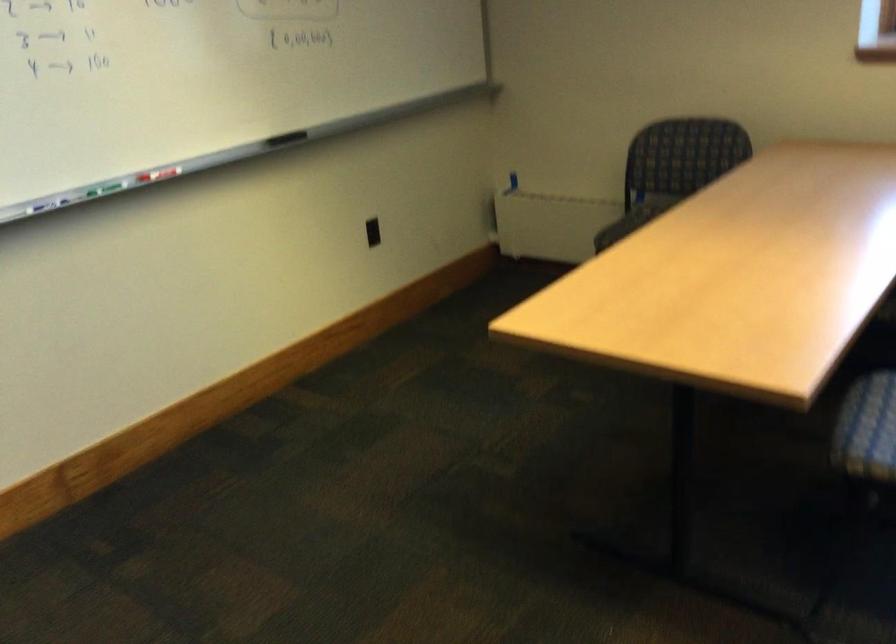
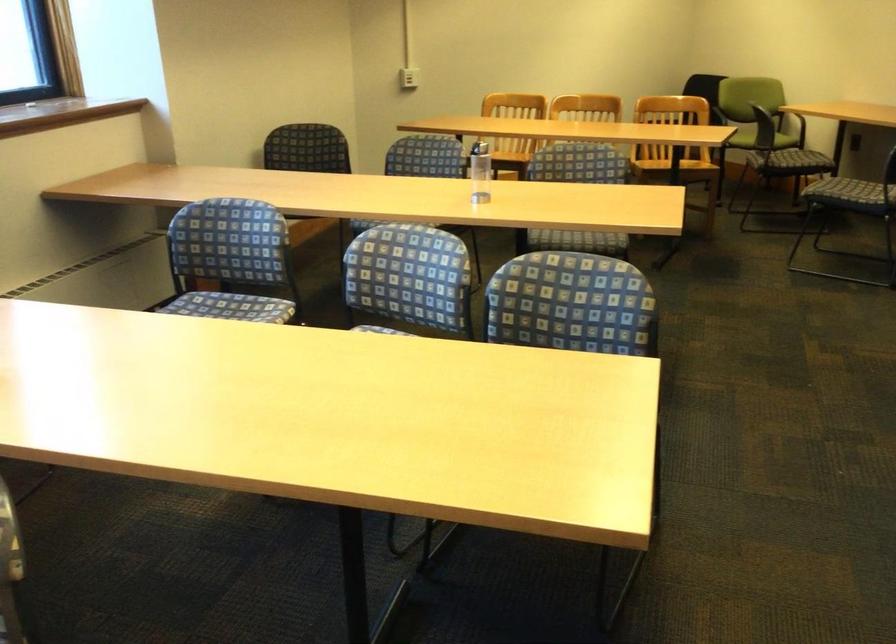
The images are taken continuously from a first-person perspective. In which direction is your viewpoint rotating?

The camera rotated toward right-down.